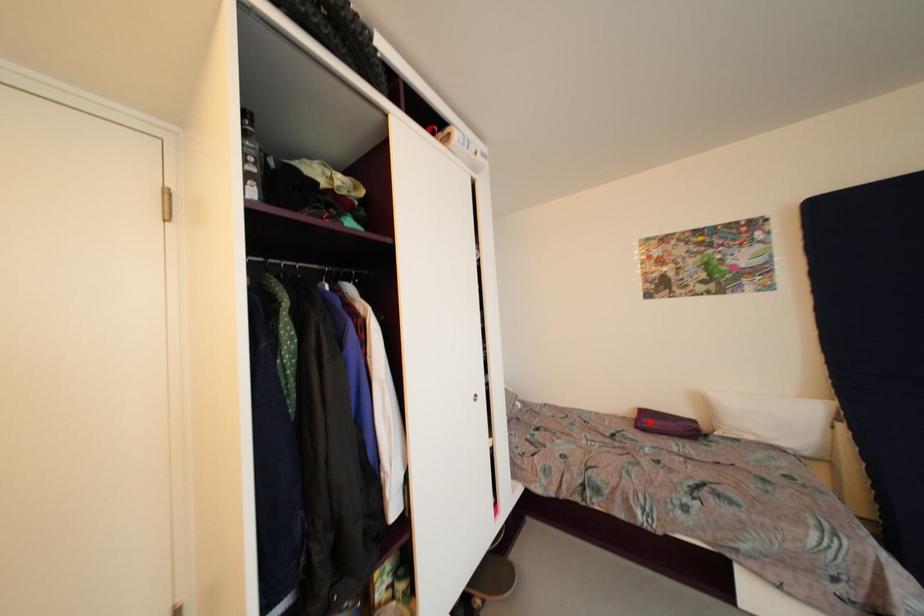
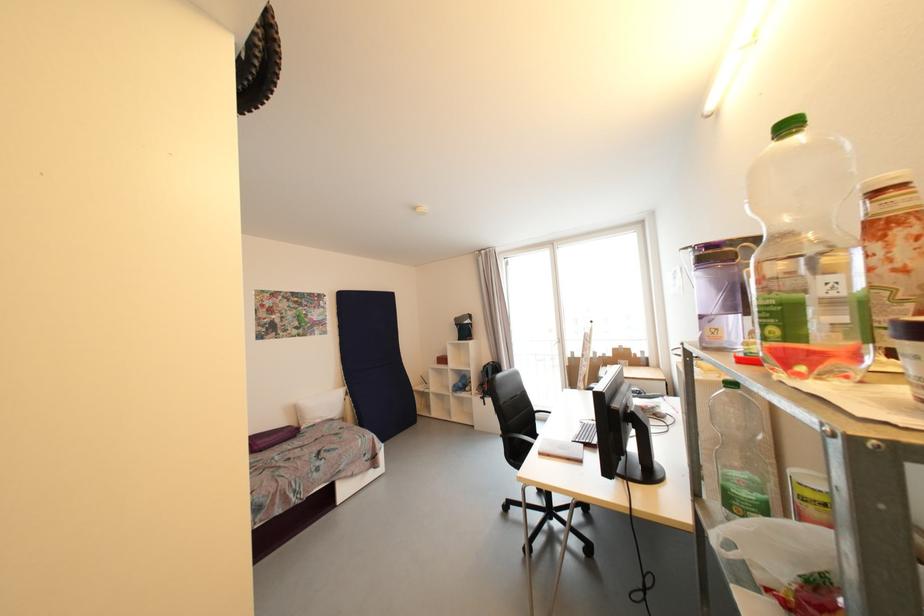
The point at the highlighted location is marked in the first image. Where is the corresponding point in the second image?

(263, 445)